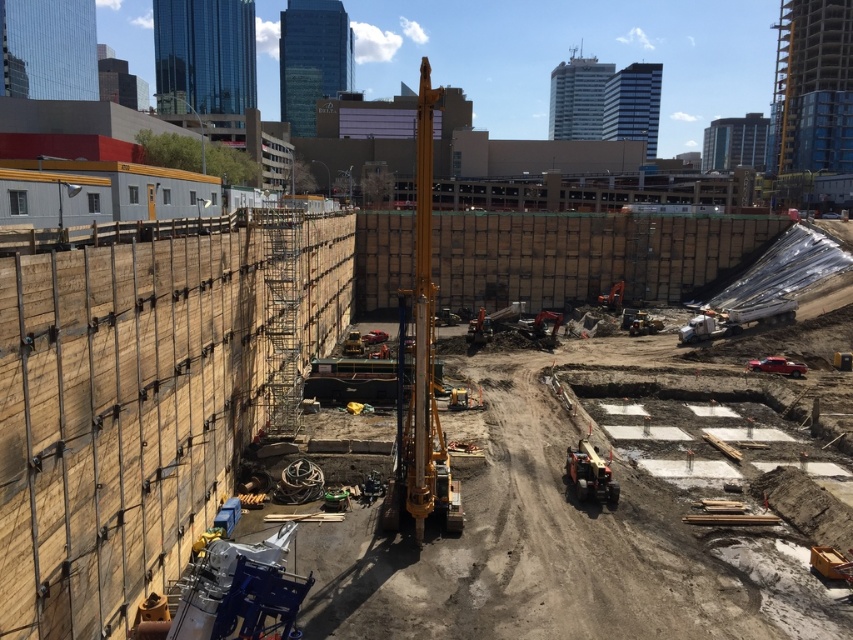
Can you confirm if yellow metallic drilling rig at center is bigger than metallic yellow crane at center?

Correct, yellow metallic drilling rig at center is larger in size than metallic yellow crane at center.

Between yellow metallic drilling rig at center and metallic yellow crane at center, which one appears on the right side from the viewer's perspective?

metallic yellow crane at center

Who is more forward, (408, 348) or (606, 477)?

Point (606, 477) is more forward.

Find the location of a particular element. Image resolution: width=853 pixels, height=640 pixels. yellow metallic drilling rig at center is located at coordinates (421, 362).